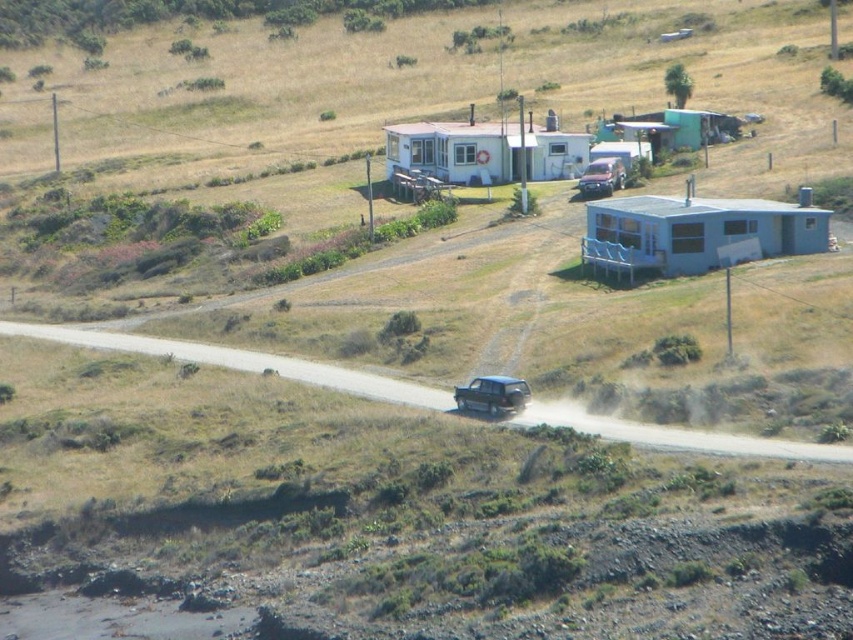
Question: From the image, what is the correct spatial relationship of brown dirt track at center in relation to metallic silver suv at center?

Choices:
 (A) below
 (B) above

Answer: (B)

Question: Which is nearer to the satin black suv at center?

Choices:
 (A) brown dirt track at center
 (B) metallic silver suv at center

Answer: (A)

Question: Which of the following is the closest to the observer?

Choices:
 (A) (485, 384)
 (B) (711, 445)
 (C) (619, 168)

Answer: (B)

Question: Does metallic silver suv at center appear over satin black suv at center?

Choices:
 (A) no
 (B) yes

Answer: (A)

Question: Among these objects, which one is nearest to the camera?

Choices:
 (A) brown dirt track at center
 (B) satin black suv at center

Answer: (A)

Question: Is brown dirt track at center to the left of satin black suv at center from the viewer's perspective?

Choices:
 (A) yes
 (B) no

Answer: (A)